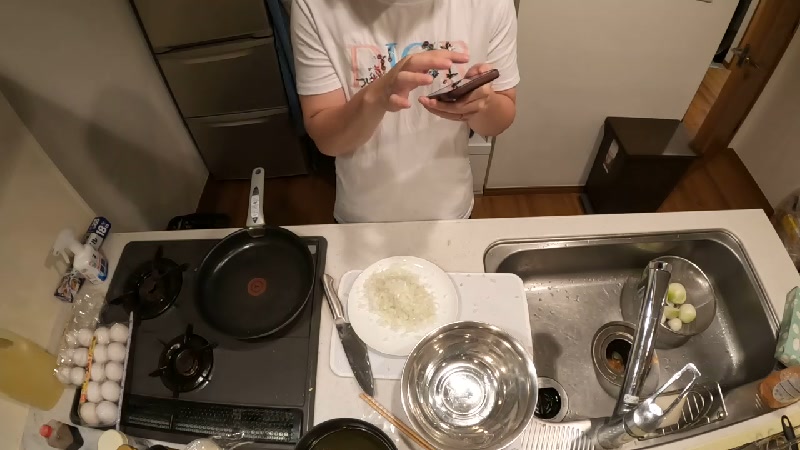
Locate an element on the screen. The height and width of the screenshot is (450, 800). bowl is located at coordinates (497, 369).